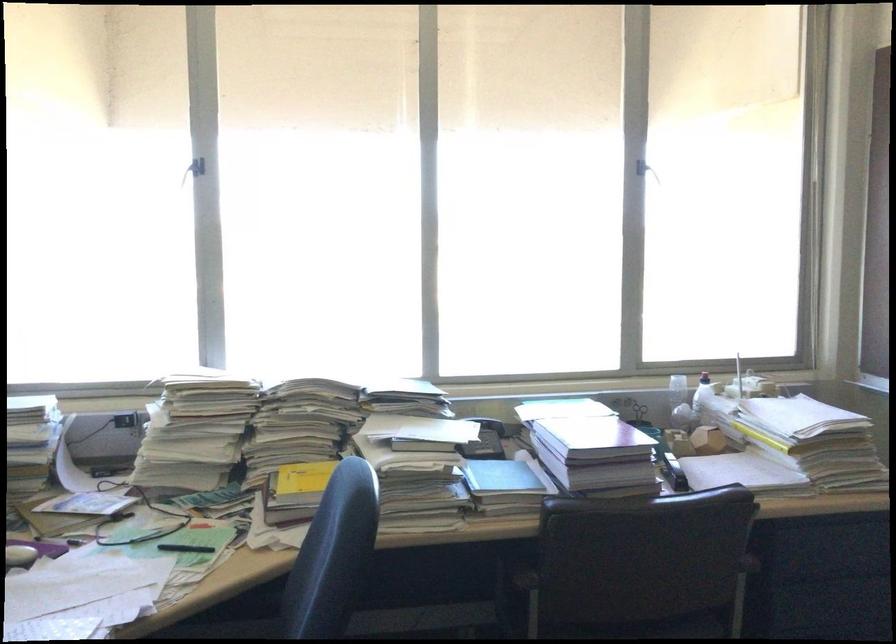
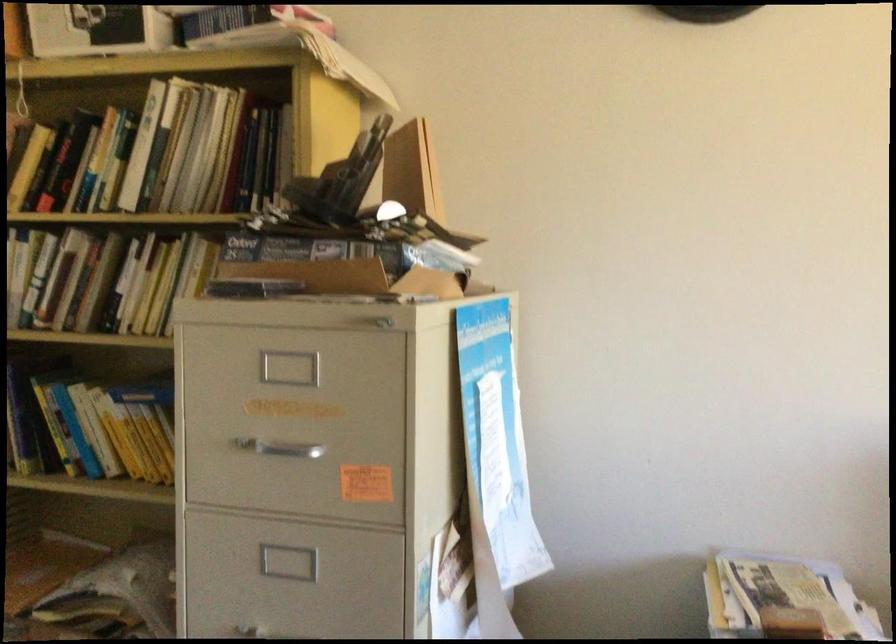
Question: The first image is from the beginning of the video and the second image is from the end. How did the camera likely rotate when shooting the video?

Choices:
 (A) Left
 (B) Right
 (C) Up
 (D) Down

Answer: (A)